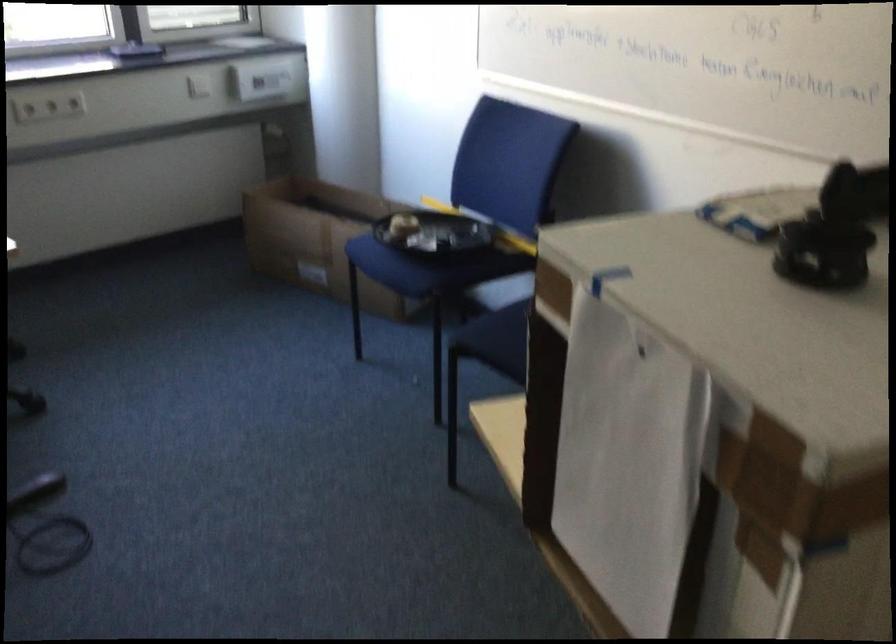
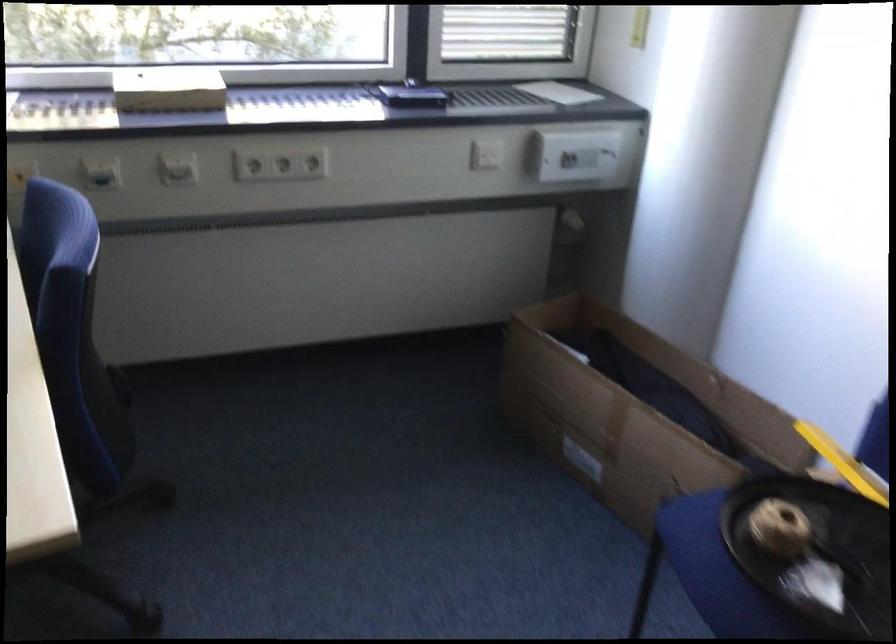
Where in the second image is the point corresponding to point (420, 234) from the first image?

(813, 552)